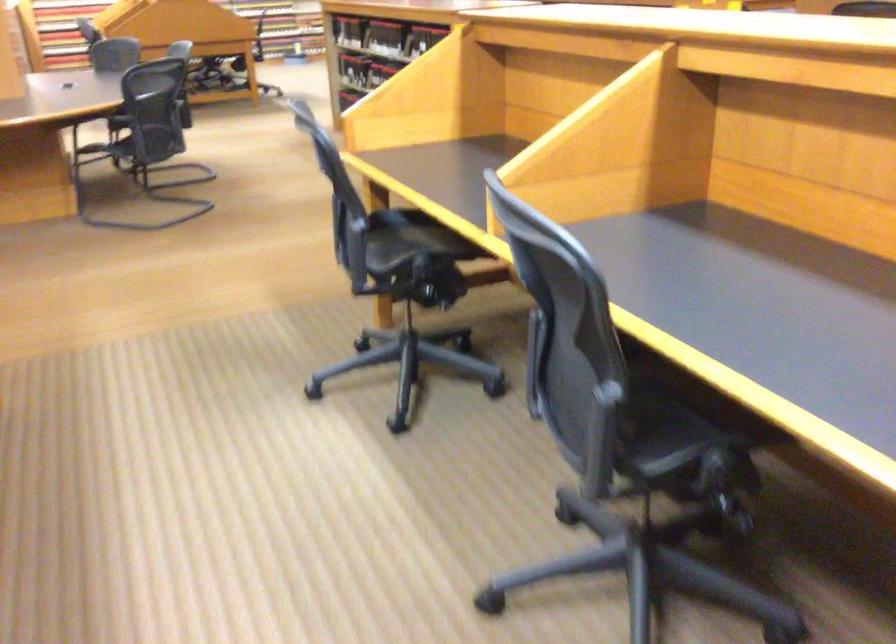
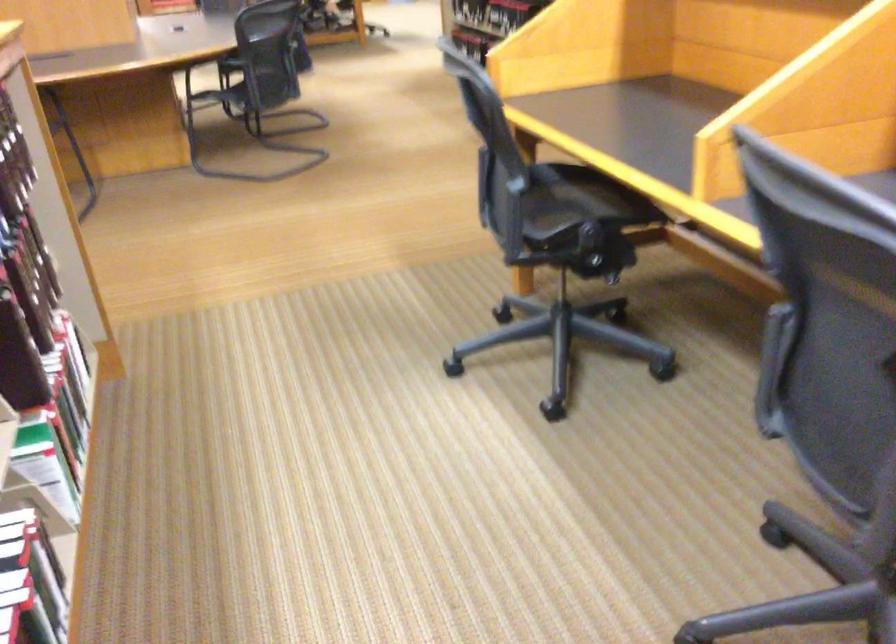
Where in the second image is the point corresponding to the point at 564,345 from the first image?

(830, 341)